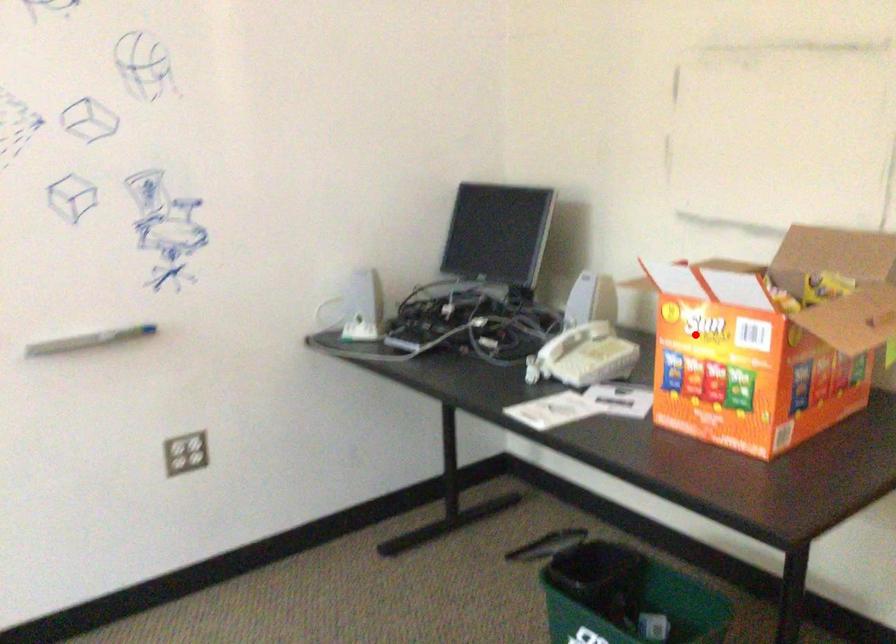
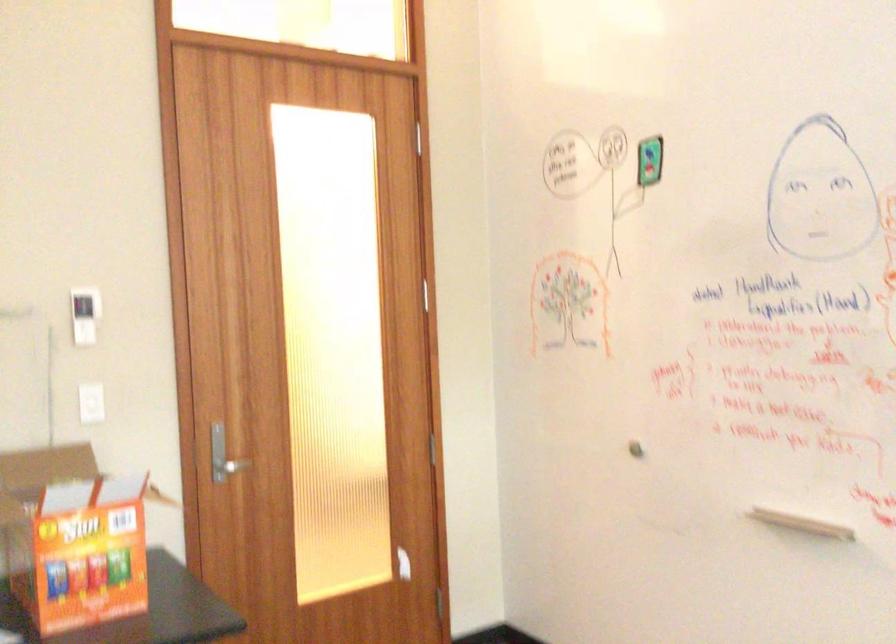
Find the pixel in the second image that matches the highlighted location in the first image.

(72, 538)